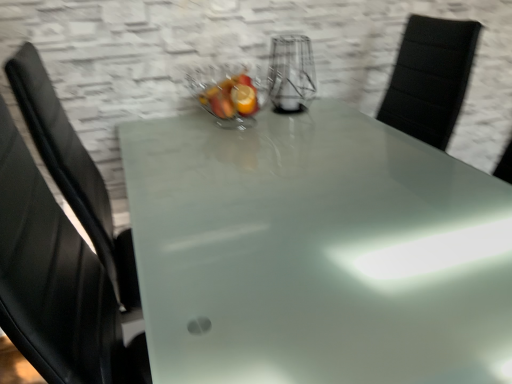
Locate an element on the screen. This screenshot has height=384, width=512. free space in front of clear glass vase at center is located at coordinates (309, 128).